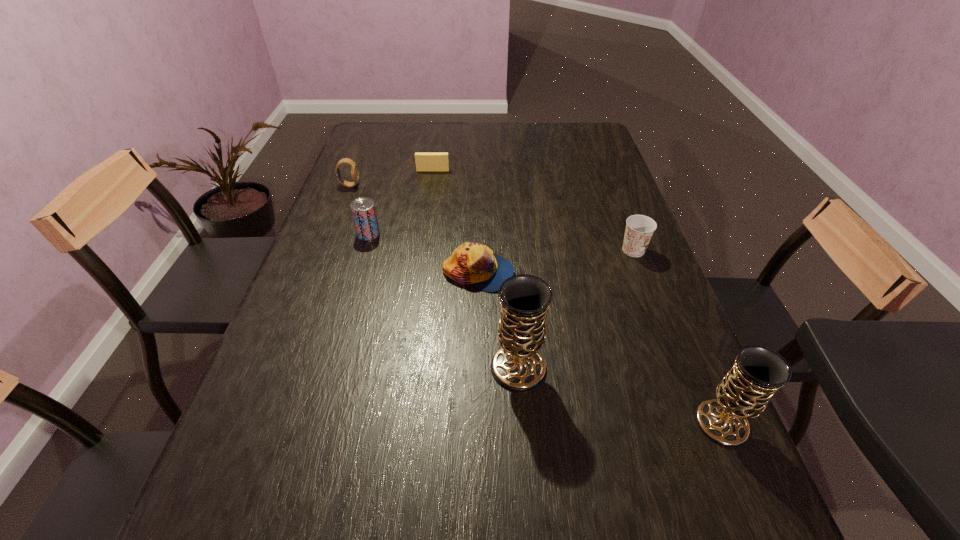
Locate an element on the screen. The width and height of the screenshot is (960, 540). blank space at the near left corner is located at coordinates (211, 489).

In the image, there is a desktop. At what (x,y) coordinates should I click in order to perform the action: click on vacant space at the far right corner. Please return your answer as a coordinate pair (x, y). Looking at the image, I should click on (585, 133).

Where is `vacant point located between the leftmost object and the Dixie cup`? The height and width of the screenshot is (540, 960). vacant point located between the leftmost object and the Dixie cup is located at coordinates (492, 218).

Find the location of `free spot between the leftmost object and the left chalice`. free spot between the leftmost object and the left chalice is located at coordinates pos(434,276).

The image size is (960, 540). In order to click on vacant region between the second nearest object and the cap in this screenshot , I will do `click(498, 320)`.

The height and width of the screenshot is (540, 960). What are the coordinates of `empty location between the Dixie cup and the watch` in the screenshot? It's located at (492, 218).

Where is `vacant space that is in between the cap and the sixth object from right to left`? vacant space that is in between the cap and the sixth object from right to left is located at coordinates (423, 253).

The image size is (960, 540). What are the coordinates of `free point between the farther chalice and the right chalice` in the screenshot? It's located at (620, 395).

Image resolution: width=960 pixels, height=540 pixels. Identify the location of free point between the Dixie cup and the watch. (492, 218).

The height and width of the screenshot is (540, 960). What are the coordinates of `vacant point located between the sixth nearest object and the sixth farthest object` in the screenshot? It's located at (434, 276).